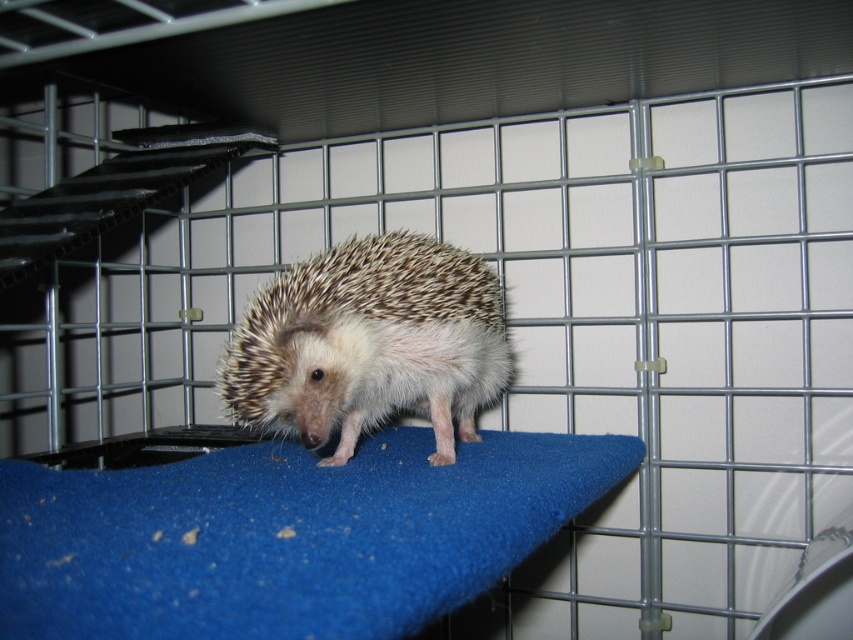
Is blue felt mat at center thinner than brown spiny hedgehog at center?

Incorrect, blue felt mat at center's width is not less than brown spiny hedgehog at center's.

Measure the distance from blue felt mat at center to brown spiny hedgehog at center.

blue felt mat at center and brown spiny hedgehog at center are 5.95 inches apart from each other.

Is point (390, 452) less distant than point (305, 298)?

That is False.

Where is `blue felt mat at center`? This screenshot has width=853, height=640. blue felt mat at center is located at coordinates (286, 536).